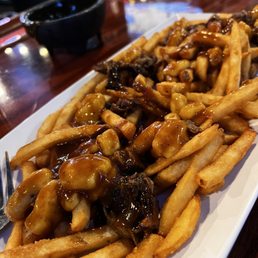
Identify the location of light. The height and width of the screenshot is (258, 258). (6, 51), (43, 53).